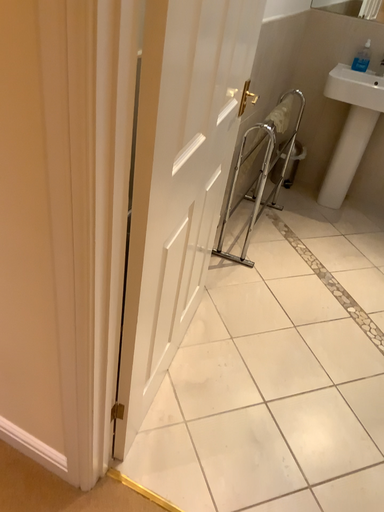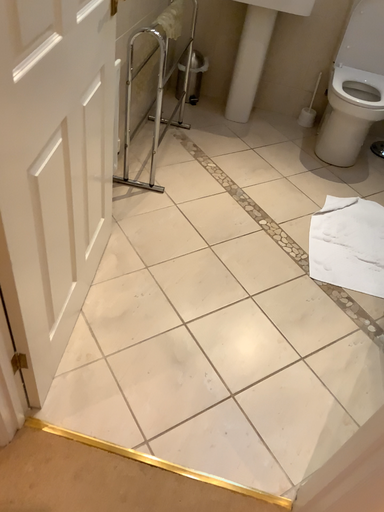
Question: Which way did the camera rotate in the video?

Choices:
 (A) rotated upward
 (B) rotated downward

Answer: (B)